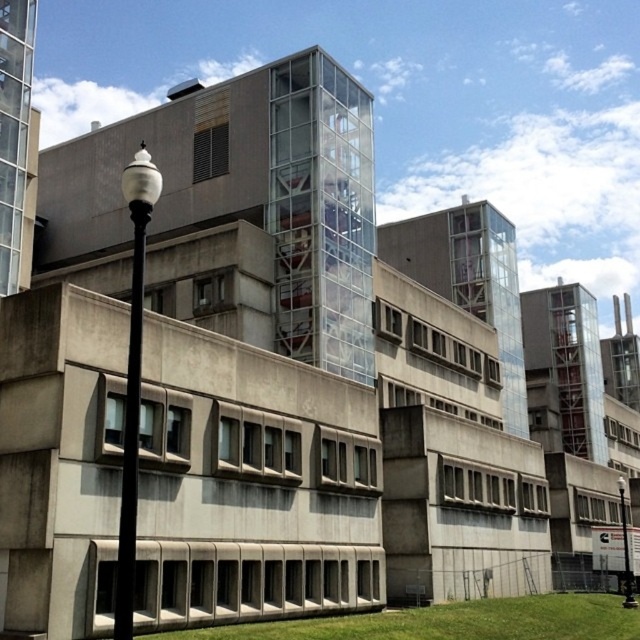
You are standing at the point marked as point (449,621) in the image. What is the immediate surface you are standing on?

The immediate surface at point (449,621) is the green grass at lower center.